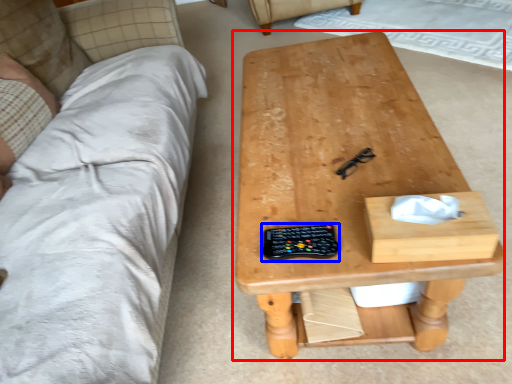
Question: Which of the following is the farthest to the observer, table (highlighted by a red box) or control (highlighted by a blue box)?

Choices:
 (A) table
 (B) control

Answer: (B)